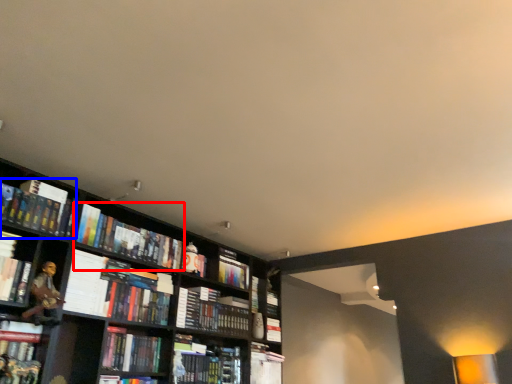
Question: Which point is closer to the camera, book (highlighted by a red box) or book (highlighted by a blue box)?

Choices:
 (A) book
 (B) book

Answer: (B)